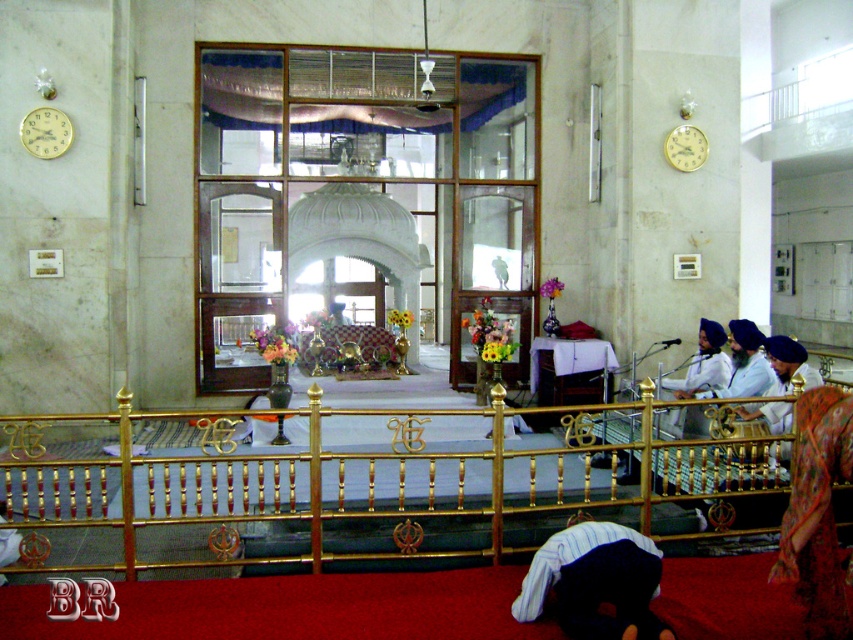
Question: Is the position of gold polished rail at center less distant than that of floral-patterned fabric at lower right?

Choices:
 (A) no
 (B) yes

Answer: (A)

Question: Which of the following is the closest to the observer?

Choices:
 (A) (338, 520)
 (B) (579, 637)
 (C) (795, 572)

Answer: (C)

Question: Does gold polished rail at center lie behind dark blue turban at lower center?

Choices:
 (A) yes
 (B) no

Answer: (A)

Question: Among these points, which one is nearest to the camera?

Choices:
 (A) (798, 403)
 (B) (573, 556)
 (C) (618, 467)

Answer: (B)

Question: Is gold polished rail at center to the right of dark blue turban at lower center from the viewer's perspective?

Choices:
 (A) yes
 (B) no

Answer: (B)

Question: Among these objects, which one is nearest to the camera?

Choices:
 (A) dark blue turban at lower center
 (B) floral-patterned fabric at lower right

Answer: (B)